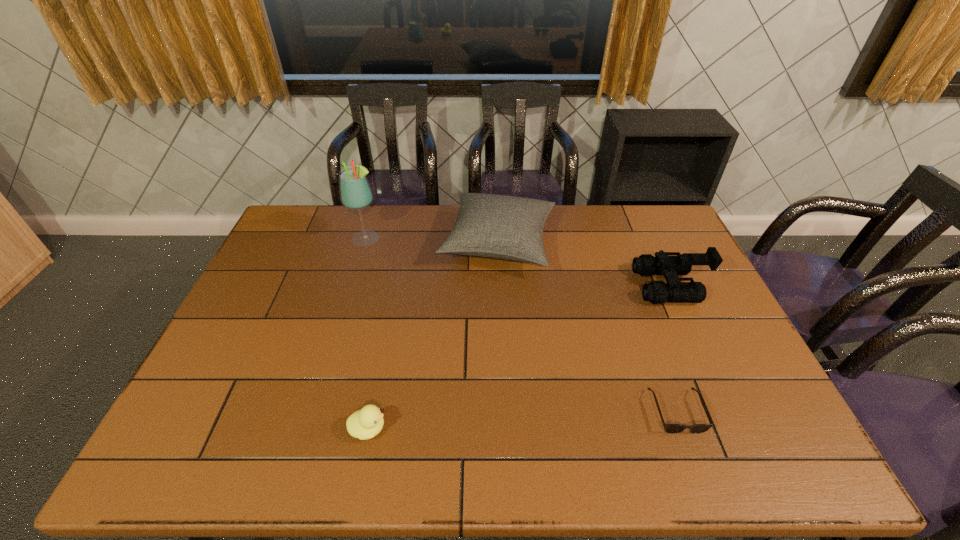
Where is `vacant area at the right edge`? This screenshot has width=960, height=540. vacant area at the right edge is located at coordinates pos(688,249).

This screenshot has height=540, width=960. What are the coordinates of `free space at the near left corner of the desktop` in the screenshot? It's located at (218, 453).

Find the location of a particular element. free space at the far right corner of the desktop is located at coordinates (667, 221).

Identify the location of empty location between the binoculars and the shortest object. (674, 348).

Where is `empty space between the fourth object from right to left and the third object from right to left`? Image resolution: width=960 pixels, height=540 pixels. empty space between the fourth object from right to left and the third object from right to left is located at coordinates (433, 336).

Where is `free spot between the third object from right to left and the binoculars`? This screenshot has height=540, width=960. free spot between the third object from right to left and the binoculars is located at coordinates (585, 265).

Find the location of a particular element. This screenshot has width=960, height=540. free spot between the binoculars and the tallest object is located at coordinates (519, 262).

The height and width of the screenshot is (540, 960). Identify the location of vacant region between the sunglasses and the binoculars. click(x=674, y=348).

Image resolution: width=960 pixels, height=540 pixels. In order to click on free space between the binoculars and the leftmost object in this screenshot , I will do `click(519, 262)`.

Find the location of a particular element. This screenshot has height=540, width=960. free space between the binoculars and the fourth tallest object is located at coordinates (519, 357).